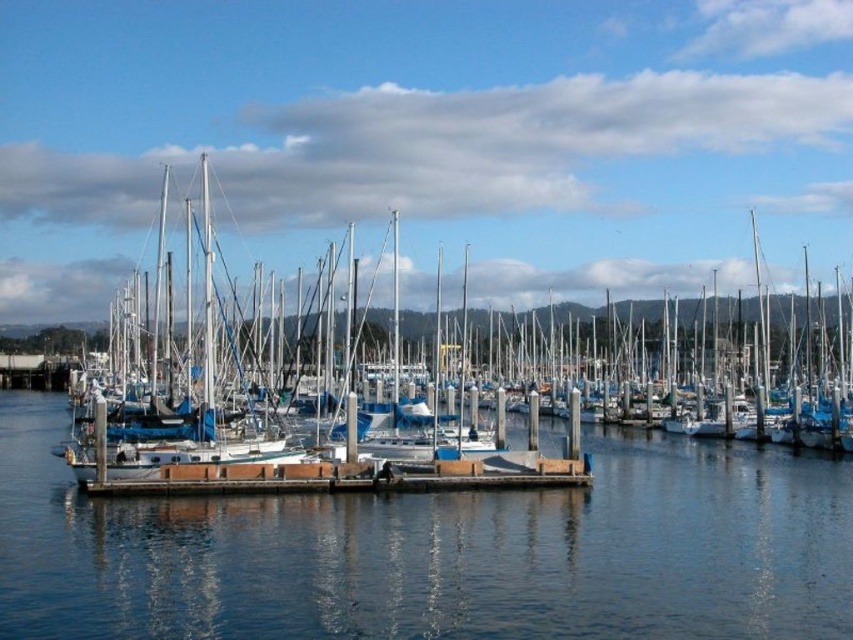
From the picture: Can you confirm if white matte sailboat at center is taller than brown wooden dock at center?

Correct, white matte sailboat at center is much taller as brown wooden dock at center.

Does white matte sailboat at center appear on the left side of brown wooden dock at center?

Incorrect, white matte sailboat at center is not on the left side of brown wooden dock at center.

At what (x,y) coordinates should I click in order to perform the action: click on white matte sailboat at center. Please return your answer as a coordinate pair (x, y). The image size is (853, 640). Looking at the image, I should click on (466, 378).

Which is behind, point (575, 568) or point (305, 477)?

The point (305, 477) is more distant.

Who is more forward, (242, 573) or (552, 460)?

Point (242, 573)

The image size is (853, 640). I want to click on clear water at center, so click(434, 552).

Between clear water at center and white matte sailboat at center, which one is positioned higher?

Positioned higher is white matte sailboat at center.

Where is `clear water at center`? The width and height of the screenshot is (853, 640). clear water at center is located at coordinates click(x=434, y=552).

Image resolution: width=853 pixels, height=640 pixels. What are the coordinates of `clear water at center` in the screenshot? It's located at (434, 552).